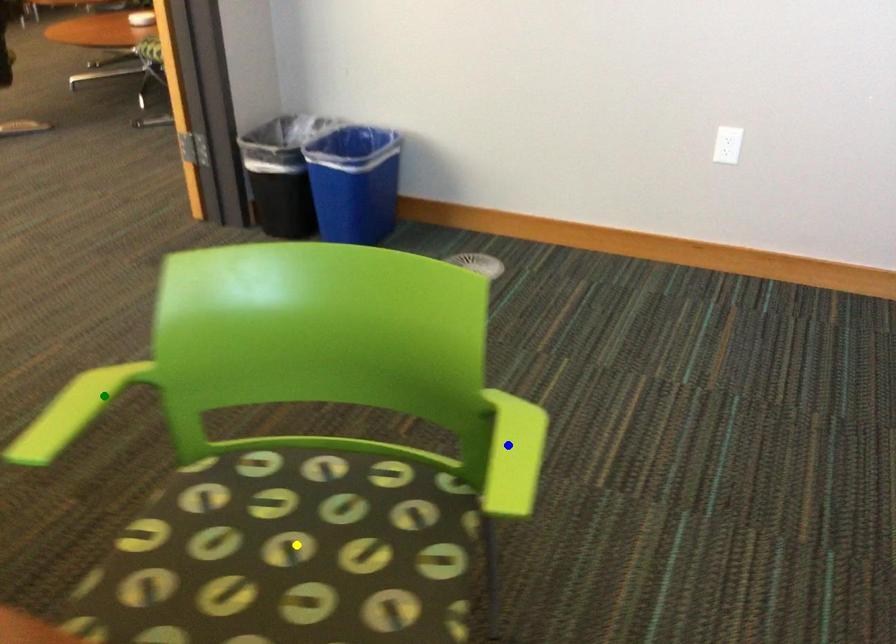
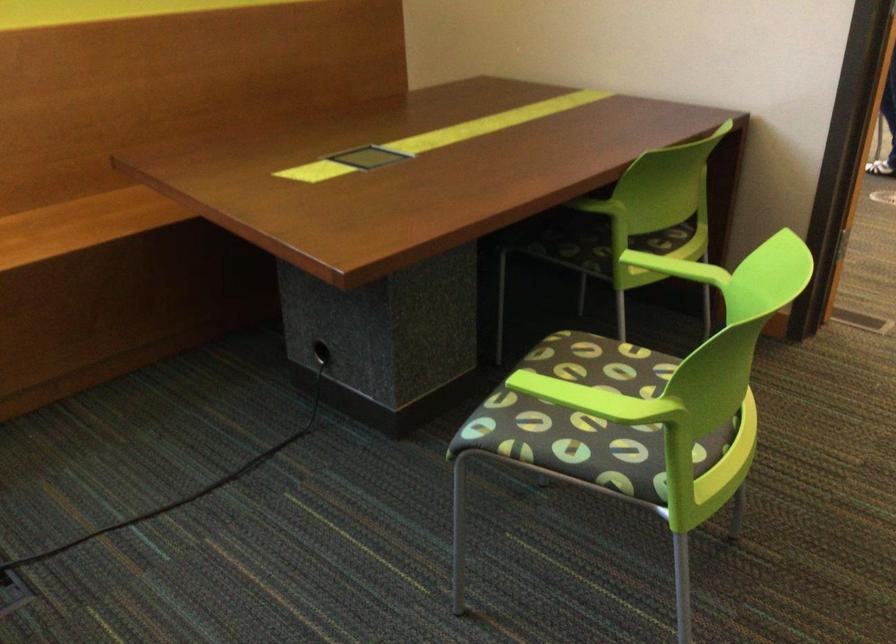
I am providing you with two images of the same scene from different viewpoints. Three points are marked in image1. Which point corresponds to a part or object that is occluded in image2?In image1, three points are marked. Which of them correspond to a part or object that is occluded in image2?Among the three points shown in image1, which one corresponds to a part or object that is no longer visible due to occlusion in image2?

Invisible in image2: yellow point.